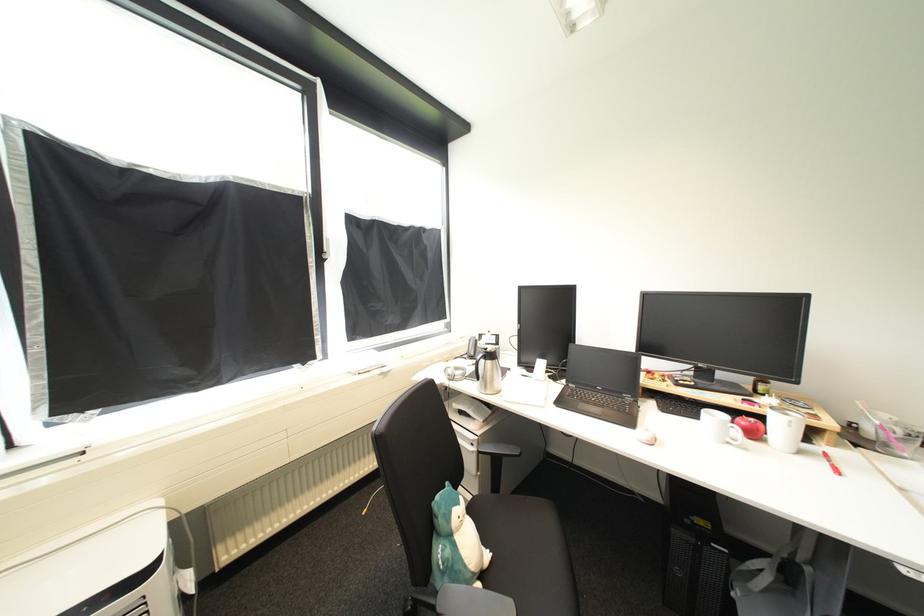
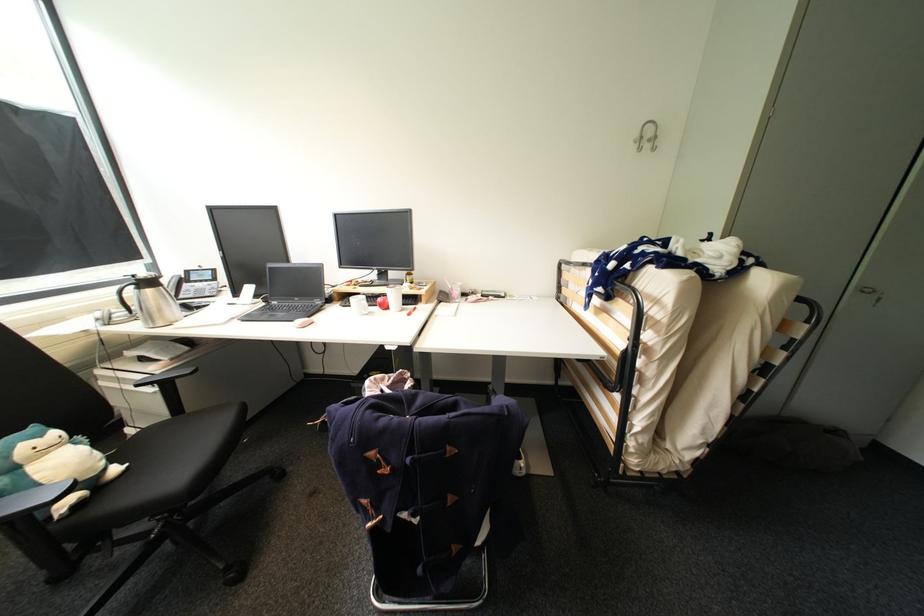
Question: The camera is either moving clockwise (left) or counter-clockwise (right) around the object. The first image is from the beginning of the video and the second image is from the end. Is the camera moving left or right when shooting the video?

Choices:
 (A) Left
 (B) Right

Answer: (A)